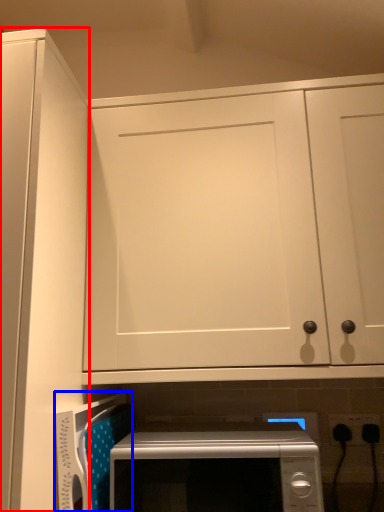
Question: Among these objects, which one is farthest to the camera, door (highlighted by a red box) or appliance (highlighted by a blue box)?

Choices:
 (A) door
 (B) appliance

Answer: (B)